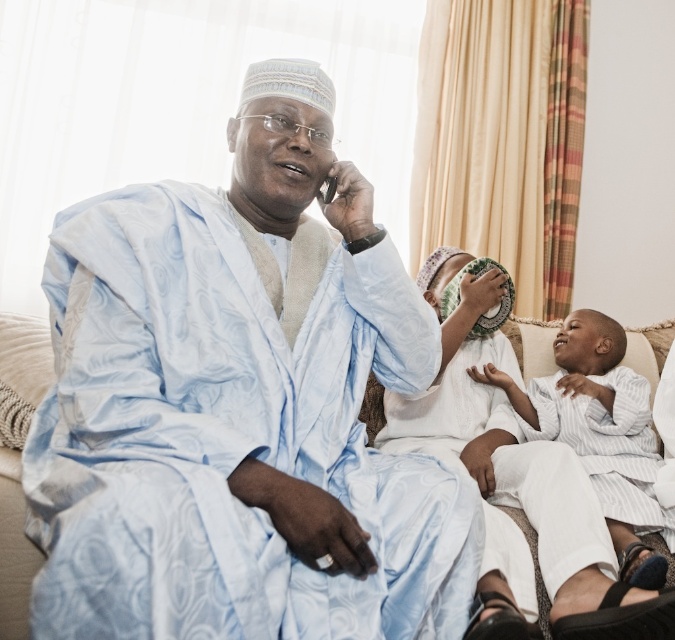
You are a guest in this living room and want to place a small vase on the white striped cloth at center and the white striped cloth at lower right. Which cloth should you choose if you want the vase to be more visible to people entering the room?

The white striped cloth at center is closer to the viewer than the white striped cloth at lower right, so placing the vase on the white striped cloth at center would make it more visible to people entering the room.

Based on the photo, you are standing in the living room and need to place a small decorative item on the exact spot where the satin blue robe at center is located. What coordinates should you aim for?

The coordinates for the satin blue robe at center are 0.636 in the x direction and 0.356 in the y direction.

You are standing in the living room and want to place a small plant between the two points marked as point (383, 426) and point (626, 474). Which point should the plant be closer to in order to be nearer to the viewer?

The plant should be closer to point (383, 426) because it is closer to the viewer than point (626, 474).